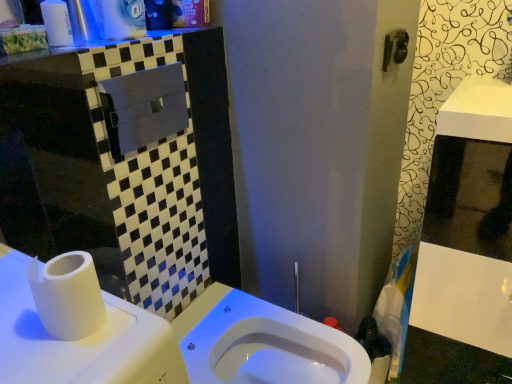
Question: Is white glossy toilet at center facing away from white plastic cup at upper left?

Choices:
 (A) no
 (B) yes

Answer: (A)

Question: Can you confirm if white glossy toilet at center is smaller than white plastic cup at upper left?

Choices:
 (A) no
 (B) yes

Answer: (A)

Question: Is white glossy toilet at center oriented towards white plastic cup at upper left?

Choices:
 (A) yes
 (B) no

Answer: (B)

Question: From a real-world perspective, does white glossy toilet at center sit lower than white plastic cup at upper left?

Choices:
 (A) yes
 (B) no

Answer: (A)

Question: Does white glossy toilet at center have a lesser width compared to white plastic cup at upper left?

Choices:
 (A) no
 (B) yes

Answer: (A)

Question: Does white glossy toilet at center have a lesser height compared to white plastic cup at upper left?

Choices:
 (A) no
 (B) yes

Answer: (A)

Question: From a real-world perspective, is white glossy toilet at center physically above white glossy medicine cabinet at right?

Choices:
 (A) yes
 (B) no

Answer: (B)

Question: Considering the relative sizes of white glossy toilet at center and white glossy medicine cabinet at right in the image provided, is white glossy toilet at center smaller than white glossy medicine cabinet at right?

Choices:
 (A) no
 (B) yes

Answer: (B)

Question: Can you confirm if white glossy toilet at center is positioned to the left of white glossy medicine cabinet at right?

Choices:
 (A) no
 (B) yes

Answer: (B)

Question: Is the depth of white glossy toilet at center greater than that of white glossy medicine cabinet at right?

Choices:
 (A) no
 (B) yes

Answer: (B)

Question: From the image's perspective, is white glossy toilet at center under white glossy medicine cabinet at right?

Choices:
 (A) yes
 (B) no

Answer: (A)

Question: Does white glossy toilet at center have a larger size compared to white glossy medicine cabinet at right?

Choices:
 (A) no
 (B) yes

Answer: (A)

Question: Is white plastic cup at upper left next to white glossy counter top at upper left and touching it?

Choices:
 (A) no
 (B) yes

Answer: (A)